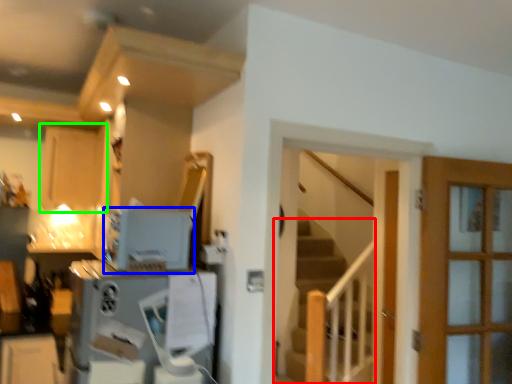
Question: Which object is positioned farthest from stairs (highlighted by a red box)? Select from appliance (highlighted by a blue box) and cabinetry (highlighted by a green box).

Choices:
 (A) appliance
 (B) cabinetry

Answer: (A)